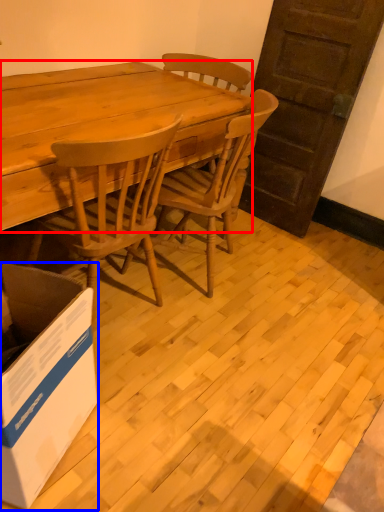
Question: Among these objects, which one is nearest to the camera, desk (highlighted by a red box) or box (highlighted by a blue box)?

Choices:
 (A) desk
 (B) box

Answer: (B)